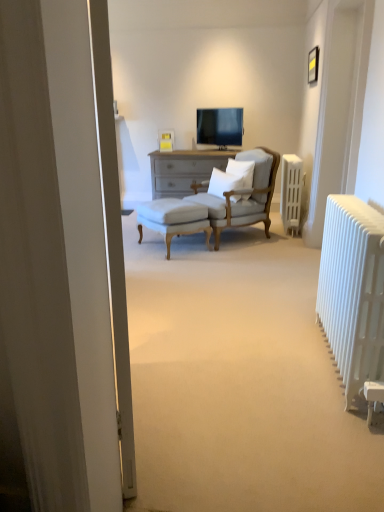
Question: In terms of width, does white soft pillow at center, which appears as the 1th pillow when viewed from the right, look wider or thinner when compared to matte black tv at center?

Choices:
 (A) wide
 (B) thin

Answer: (B)

Question: In the image, is white soft pillow at center, the second pillow viewed from the left, positioned in front of or behind matte black tv at center?

Choices:
 (A) behind
 (B) front

Answer: (B)

Question: Considering the real-world distances, which object is closest to the white soft cushion at center, which appears as the second pillow when viewed from the right?

Choices:
 (A) white metallic radiator at right, the first radiator positioned from the bottom
 (B) white soft pillow at center, which appears as the 1th pillow when viewed from the right
 (C) white plastic radiator at right, which is counted as the 2th radiator, starting from the front
 (D) white upholstered stool at center
 (E) matte black tv at center

Answer: (B)

Question: Which object is the closest to the white upholstered stool at center?

Choices:
 (A) light beige fabric armchair at center
 (B) white plastic radiator at right, placed as the 1th radiator when sorted from right to left
 (C) matte black tv at center
 (D) white soft cushion at center, which ranks as the first pillow in left-to-right order
 (E) white soft pillow at center, the second pillow viewed from the left

Answer: (A)